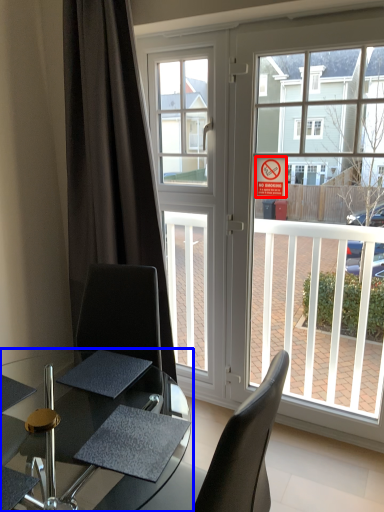
Question: Which of the following is the closest to the observer, parking sign (highlighted by a red box) or table (highlighted by a blue box)?

Choices:
 (A) parking sign
 (B) table

Answer: (B)